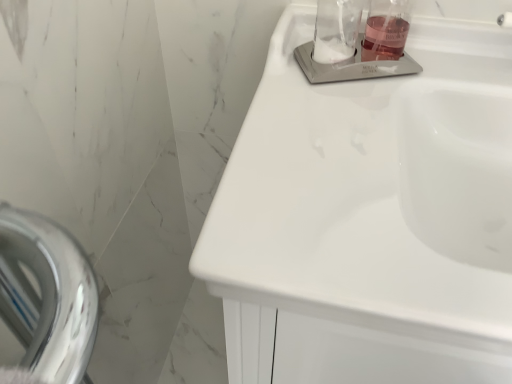
Question: Does translucent glass liquid at upper right have a lesser height compared to clear glass jar at upper center?

Choices:
 (A) yes
 (B) no

Answer: (A)

Question: Does translucent glass liquid at upper right have a lesser width compared to clear glass jar at upper center?

Choices:
 (A) yes
 (B) no

Answer: (B)

Question: Would you say translucent glass liquid at upper right contains clear glass jar at upper center?

Choices:
 (A) yes
 (B) no

Answer: (B)

Question: From a real-world perspective, is translucent glass liquid at upper right positioned under clear glass jar at upper center based on gravity?

Choices:
 (A) yes
 (B) no

Answer: (A)

Question: Does translucent glass liquid at upper right turn towards clear glass jar at upper center?

Choices:
 (A) no
 (B) yes

Answer: (A)

Question: Can you confirm if translucent glass liquid at upper right is smaller than clear glass jar at upper center?

Choices:
 (A) yes
 (B) no

Answer: (A)

Question: Is clear glass jar at upper center located outside translucent glass liquid at upper right?

Choices:
 (A) no
 (B) yes

Answer: (B)

Question: From a real-world perspective, is clear glass jar at upper center positioned under translucent glass liquid at upper right based on gravity?

Choices:
 (A) yes
 (B) no

Answer: (B)

Question: Is clear glass jar at upper center smaller than translucent glass liquid at upper right?

Choices:
 (A) no
 (B) yes

Answer: (A)

Question: From the image's perspective, would you say clear glass jar at upper center is positioned over translucent glass liquid at upper right?

Choices:
 (A) no
 (B) yes

Answer: (A)

Question: Considering the relative positions of clear glass jar at upper center and translucent glass liquid at upper right in the image provided, is clear glass jar at upper center to the left of translucent glass liquid at upper right from the viewer's perspective?

Choices:
 (A) no
 (B) yes

Answer: (B)

Question: Is translucent glass liquid at upper right located within clear glass jar at upper center?

Choices:
 (A) yes
 (B) no

Answer: (B)

Question: Can you confirm if clear glass soap dispenser at upper right, the first sink in the top-to-bottom sequence, is bigger than clear glass jar at upper center?

Choices:
 (A) no
 (B) yes

Answer: (B)